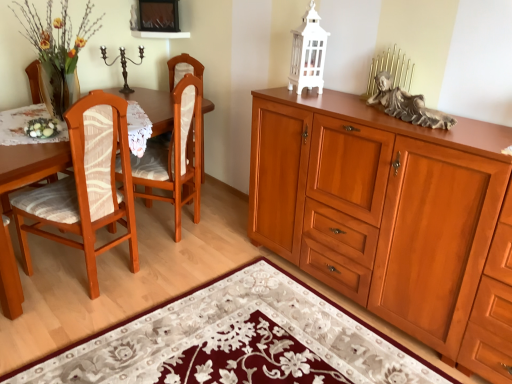
In order to click on free space that is in between wooden cabinet at right and wooden chair at left, placed as the first chair when sorted from front to back in this screenshot , I will do `click(225, 294)`.